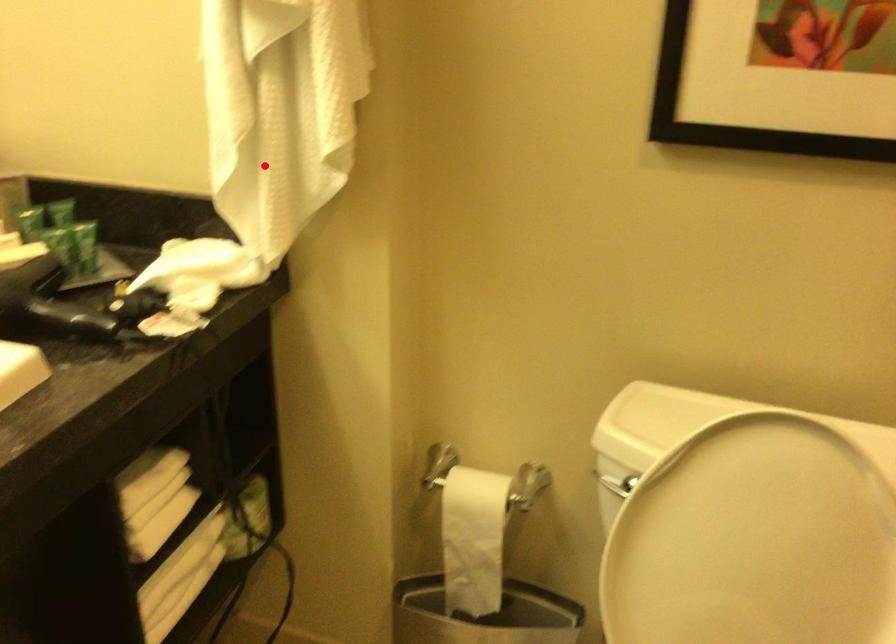
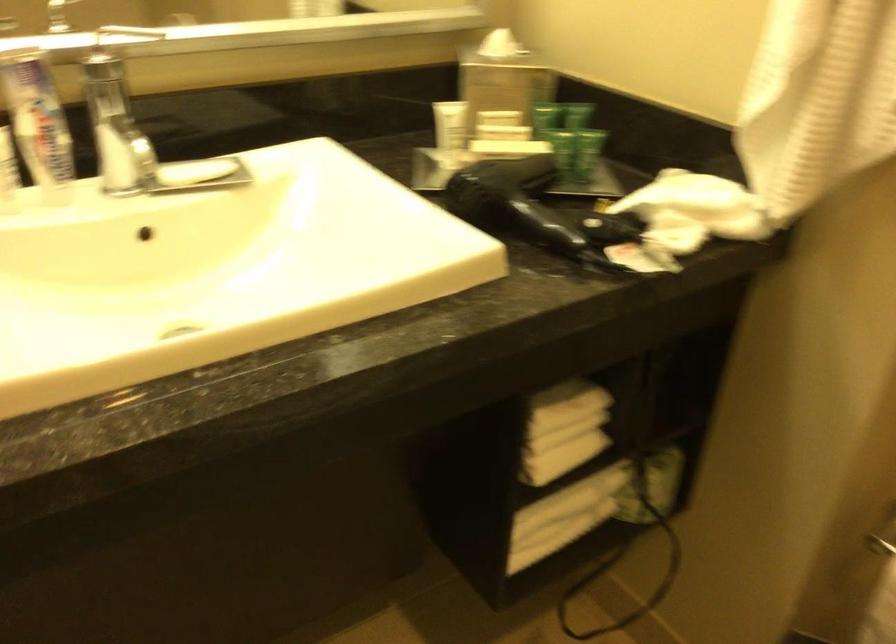
The point at the highlighted location is marked in the first image. Where is the corresponding point in the second image?

(816, 100)